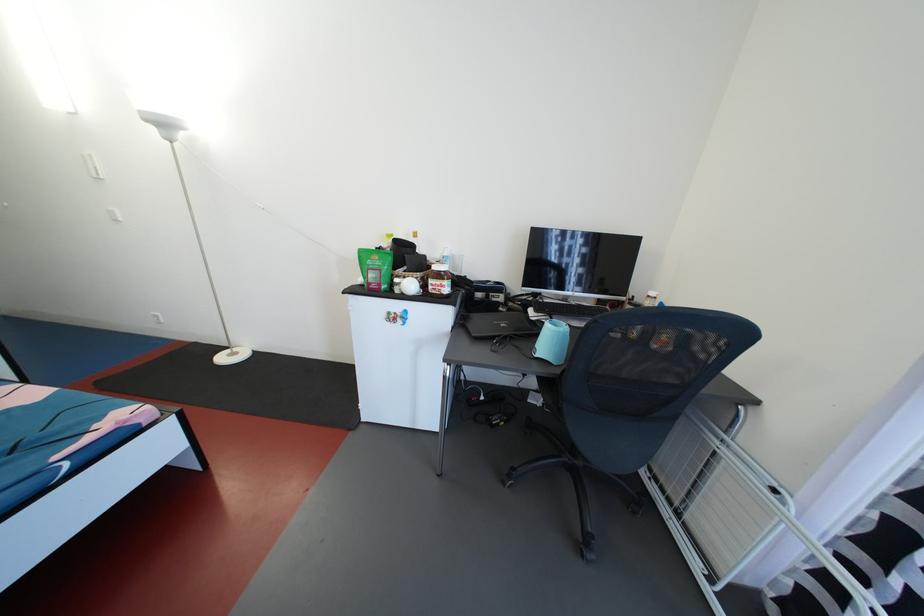
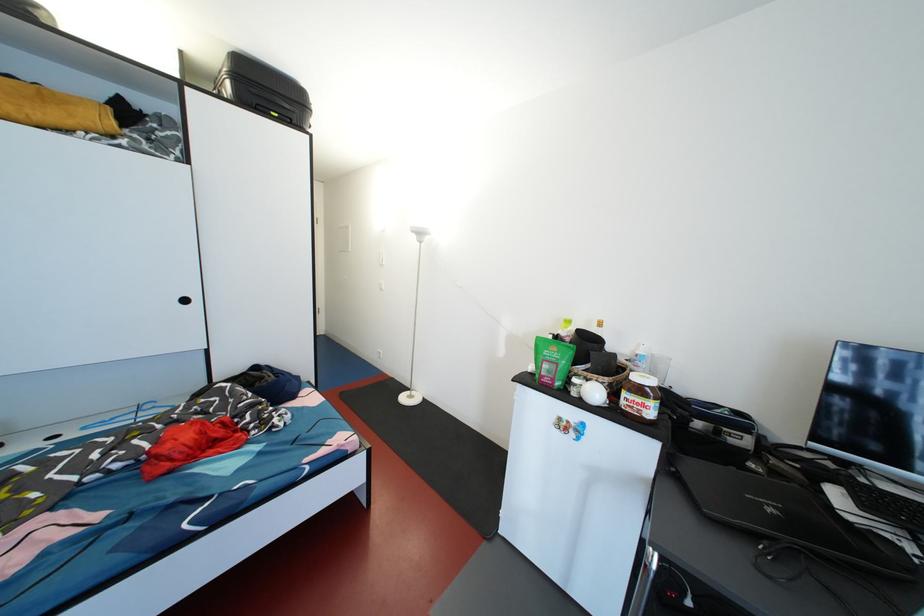
In the second image, find the point that corresponds to pixel 431 262 in the first image.

(621, 360)